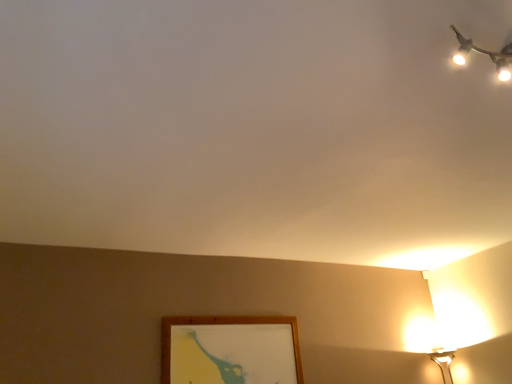
What do you see at coordinates (485, 54) in the screenshot? I see `metallic gold lamp at upper right` at bounding box center [485, 54].

At what (x,y) coordinates should I click in order to perform the action: click on metallic gold lamp at upper right. Please return your answer as a coordinate pair (x, y). Looking at the image, I should click on (485, 54).

The height and width of the screenshot is (384, 512). I want to click on metallic gold lamp at upper right, so click(x=485, y=54).